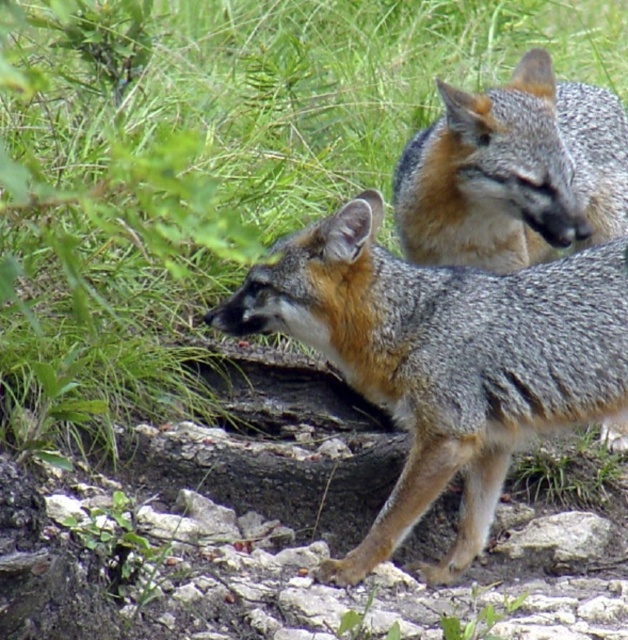
Question: Considering the real-world distances, which object is closest to the green leafy grass at upper left?

Choices:
 (A) gray fur fox at center
 (B) gray fur fox at upper right

Answer: (B)

Question: Is green leafy grass at upper left positioned before gray fur fox at center?

Choices:
 (A) yes
 (B) no

Answer: (A)

Question: Which of the following is the farthest from the observer?

Choices:
 (A) (551, 68)
 (B) (516, 300)
 (C) (450, 200)

Answer: (C)

Question: Which point is closer to the camera?

Choices:
 (A) (168, 369)
 (B) (472, 500)
 (C) (425, 241)

Answer: (B)

Question: Where is green leafy grass at upper left located in relation to gray fur fox at center in the image?

Choices:
 (A) below
 (B) above

Answer: (B)

Question: Does green leafy grass at upper left appear on the right side of gray fur fox at center?

Choices:
 (A) yes
 (B) no

Answer: (B)